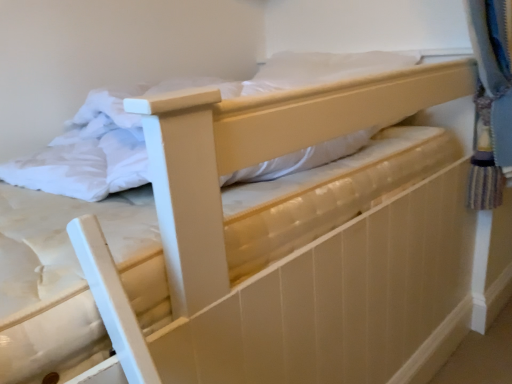
In order to face matte wood bed at center, should I rotate leftwards or rightwards?

You should look left and rotate roughly 11.700 degrees.

Describe the element at coordinates (88, 154) in the screenshot. This screenshot has width=512, height=384. I see `matte wood bed at center` at that location.

The width and height of the screenshot is (512, 384). I want to click on matte wood bed at center, so click(88, 154).

Where is `matte wood bed at center`? matte wood bed at center is located at coordinates (88, 154).